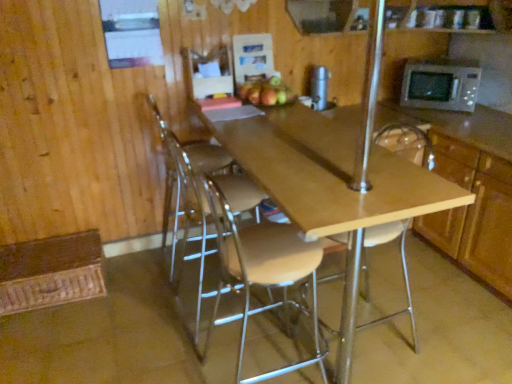
Where is `vacant region under clear plastic chair at center, which is the third chair from right to left (from a real-world perspective)`? vacant region under clear plastic chair at center, which is the third chair from right to left (from a real-world perspective) is located at coordinates (186, 258).